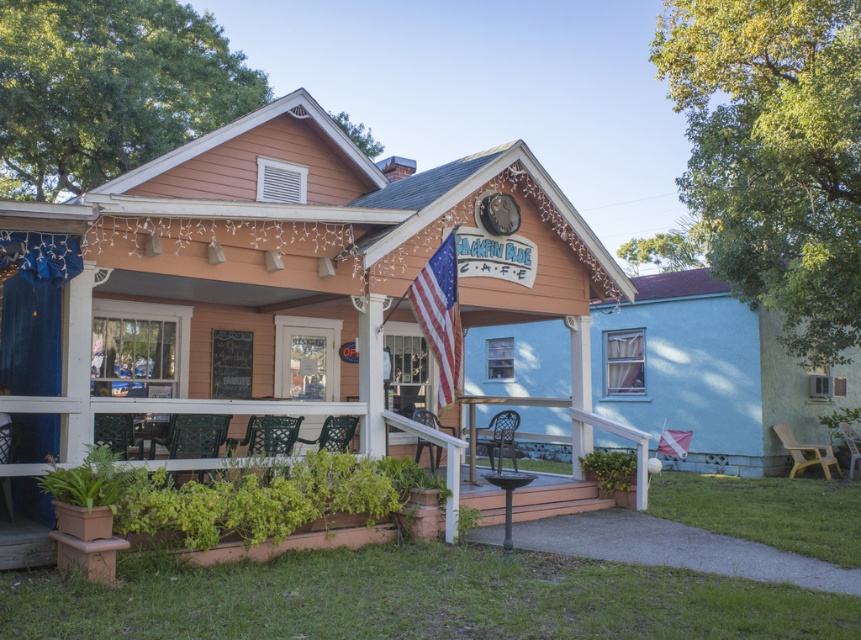
Looking at this image, you are standing in front of the building and notice the terracotta pot at lower left and the american flag at center. Which object is positioned to the left of the other?

The terracotta pot at lower left is positioned to the left of the american flag at center.

You are standing on the front porch of the building and want to place a new decorative item between the terracotta pot at lower left and the white fabric flag at center. Based on their current positions, which object should you place the new item closer to if you want it to be centered between them?

The new item should be placed closer to the terracotta pot at lower left because it is positioned on the left side of the white fabric flag at center, so the midpoint between them would require placing it closer to the terracotta pot at lower left to achieve center alignment.

You are standing on the front porch of the two story building and want to hang a new decoration. You have a choice between placing it in front of the terracotta pot at lower left or behind the white fabric flag at center. Which option would allow the decoration to be more visible from the street?

Placing the decoration in front of the terracotta pot at lower left would make it more visible from the street since the terracotta pot at lower left is in front of the white fabric flag at center, so anything placed in front of it would be less obstructed.